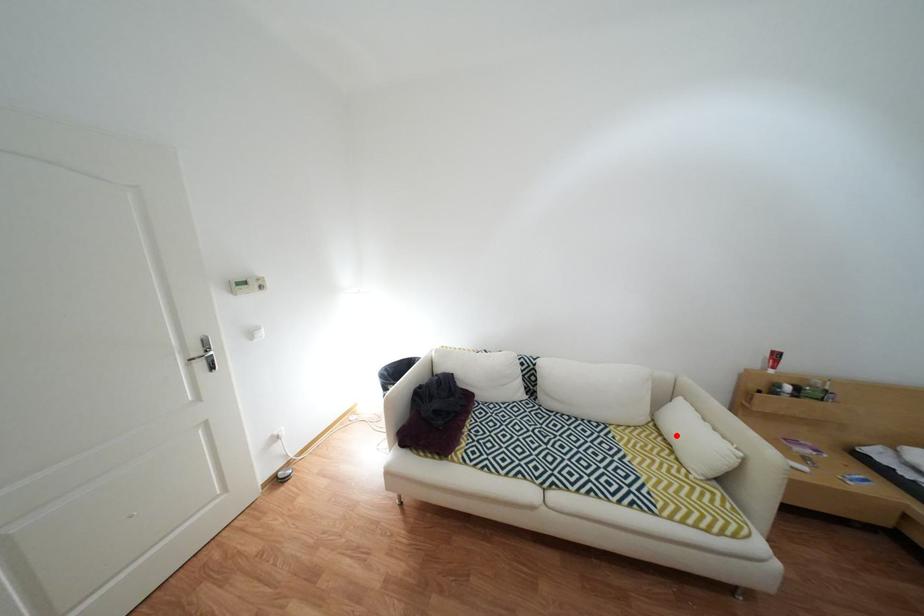
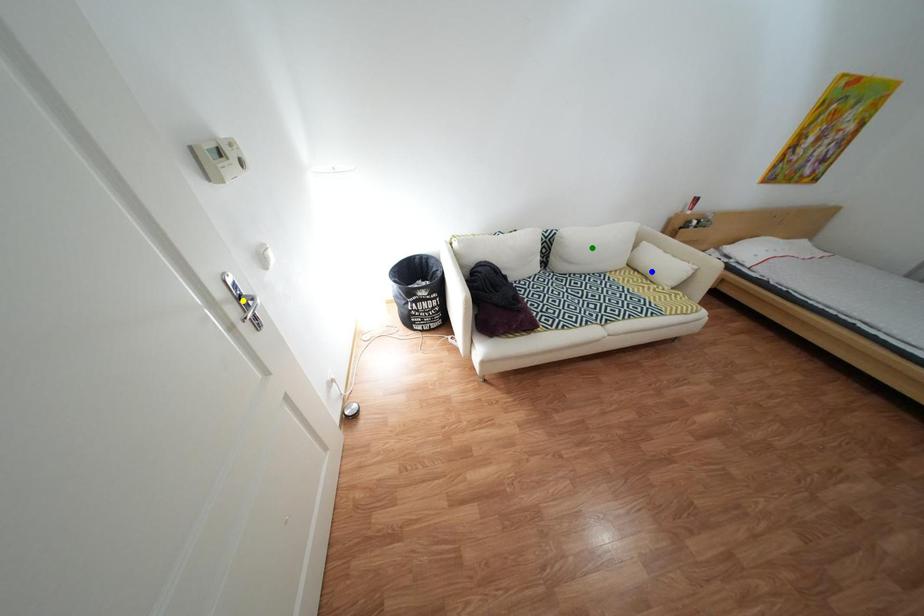
Question: I am providing you with two images of the same scene from different viewpoints. A red point is marked on the first image. You are given multiple points on the second image. Can you choose the point in image 2 that corresponds to the point in image 1?

Choices:
 (A) blue point
 (B) yellow point
 (C) green point

Answer: (A)